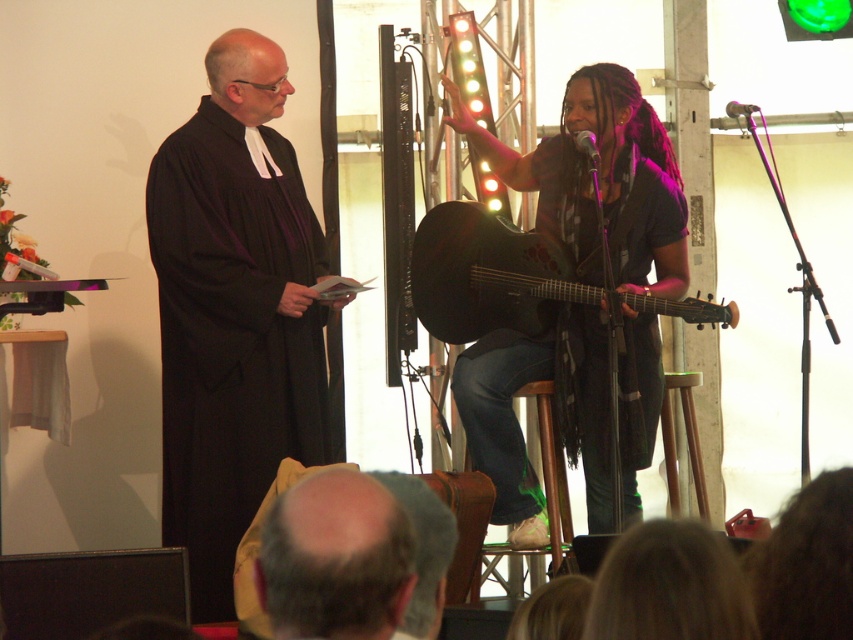
Does black matte robe at left appear on the left side of matte black acoustic guitar at center?

Indeed, black matte robe at left is positioned on the left side of matte black acoustic guitar at center.

Based on the photo, who is positioned more to the left, black matte robe at left or matte black acoustic guitar at center?

black matte robe at left

Describe the element at coordinates (231, 337) in the screenshot. The width and height of the screenshot is (853, 640). I see `black matte robe at left` at that location.

Image resolution: width=853 pixels, height=640 pixels. Find the location of `black matte robe at left`. black matte robe at left is located at coordinates (231, 337).

What do you see at coordinates (601, 177) in the screenshot? Image resolution: width=853 pixels, height=640 pixels. I see `matte black guitar at center` at bounding box center [601, 177].

Between matte black guitar at center and bald head at lower center, which one is positioned higher?

Positioned higher is matte black guitar at center.

Describe the element at coordinates (601, 177) in the screenshot. The image size is (853, 640). I see `matte black guitar at center` at that location.

At what (x,y) coordinates should I click in order to perform the action: click on matte black guitar at center. Please return your answer as a coordinate pair (x, y). This screenshot has width=853, height=640. Looking at the image, I should click on (601, 177).

Which is behind, point (323, 608) or point (590, 136)?

The point (590, 136) is behind.

This screenshot has height=640, width=853. What do you see at coordinates (335, 557) in the screenshot?
I see `bald head at lower center` at bounding box center [335, 557].

This screenshot has width=853, height=640. I want to click on bald head at lower center, so click(x=335, y=557).